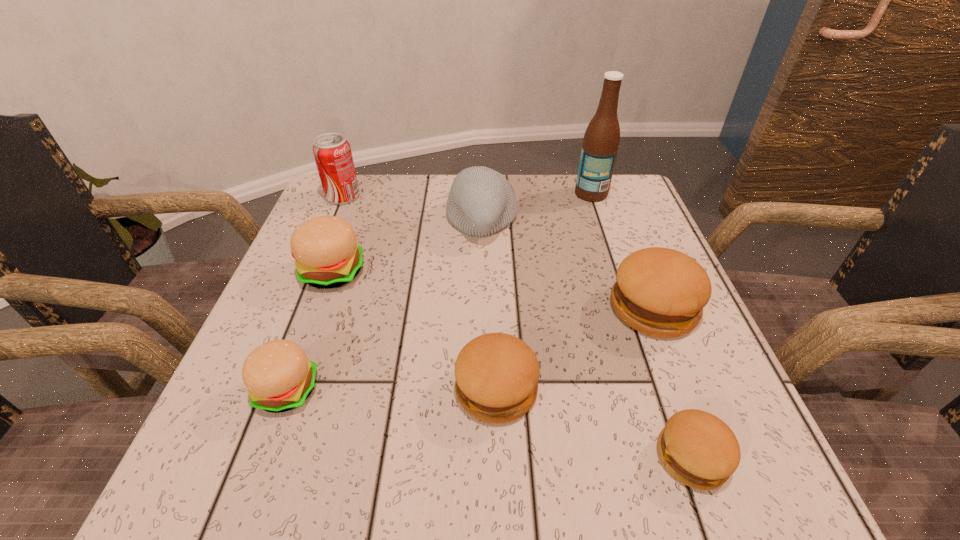
What are the coordinates of `the tallest object` in the screenshot? It's located at (601, 140).

This screenshot has height=540, width=960. In order to click on the seventh shortest object in this screenshot , I will do `click(332, 152)`.

At what (x,y) coordinates should I click in order to perform the action: click on red soda can. Please return your answer as a coordinate pair (x, y). The height and width of the screenshot is (540, 960). Looking at the image, I should click on (332, 152).

This screenshot has height=540, width=960. Identify the location of beanie. pos(481,201).

This screenshot has width=960, height=540. What are the coordinates of `the farther beige hamburger` in the screenshot? It's located at (327, 255).

Where is `the biggest brown hamburger`? the biggest brown hamburger is located at coordinates (661, 292).

The height and width of the screenshot is (540, 960). Identify the location of the leftmost brown hamburger. (497, 374).

The height and width of the screenshot is (540, 960). I want to click on the second smallest brown hamburger, so click(497, 374).

Locate an element on the screen. the nearer beige hamburger is located at coordinates (278, 376).

Find the location of a particular element. the shortest hamburger is located at coordinates (697, 448).